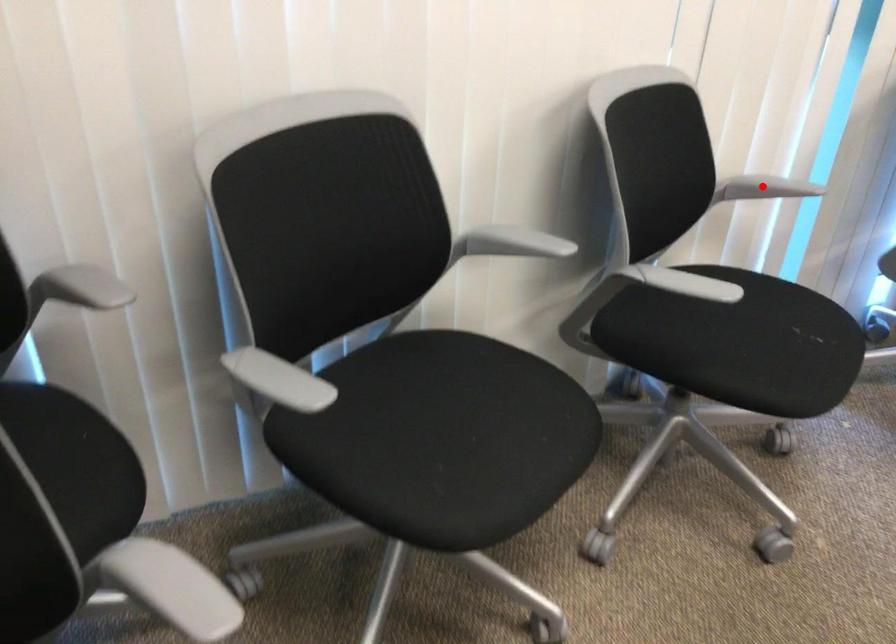
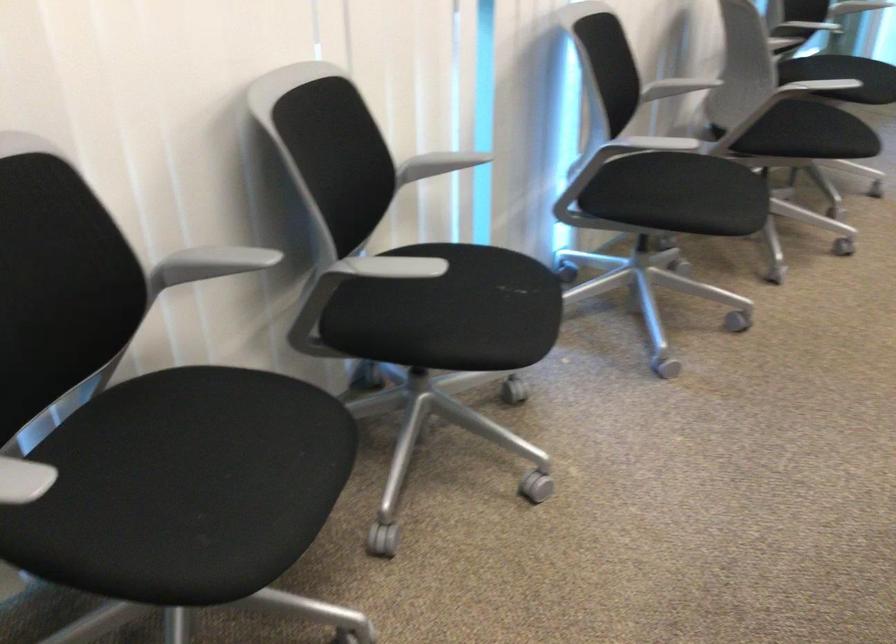
Find the pixel in the second image that matches the highlighted location in the first image.

(438, 164)